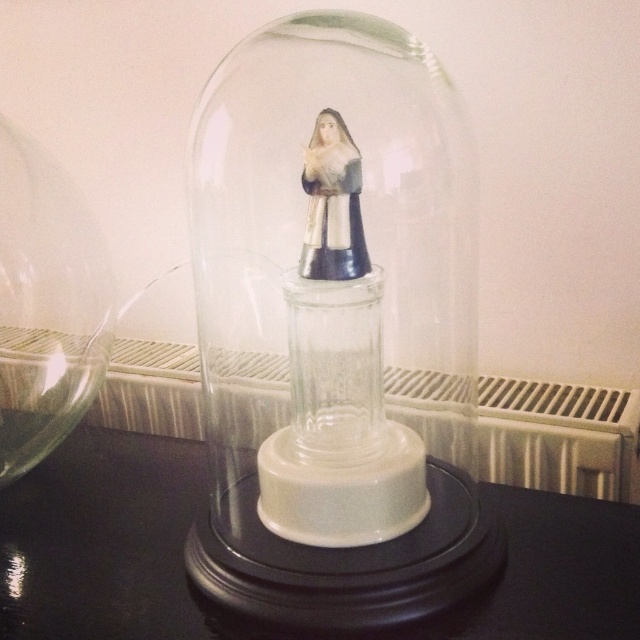
Does transparent glass dome at center come behind matte silver statue at center?

No.

Does point (227, 445) come behind point (333, 237)?

Yes, it is.

Does point (369, 280) lie in front of point (348, 212)?

No, it is behind (348, 212).

Identify the location of transparent glass dome at center. (336, 328).

Describe the element at coordinates (336, 328) in the screenshot. This screenshot has width=640, height=640. I see `transparent glass dome at center` at that location.

Can you confirm if transparent glass dome at center is positioned above black glossy table at center?

Yes.

Describe the element at coordinates (336, 328) in the screenshot. The width and height of the screenshot is (640, 640). I see `transparent glass dome at center` at that location.

Where is `transparent glass dome at center`? This screenshot has height=640, width=640. transparent glass dome at center is located at coordinates (336, 328).

Who is lower down, transparent glass dome at center or transparent glass vase at left?

transparent glass vase at left is lower down.

Can you confirm if transparent glass dome at center is positioned above transparent glass vase at left?

Yes.

This screenshot has height=640, width=640. Find the location of `transparent glass dome at center`. transparent glass dome at center is located at coordinates (336, 328).